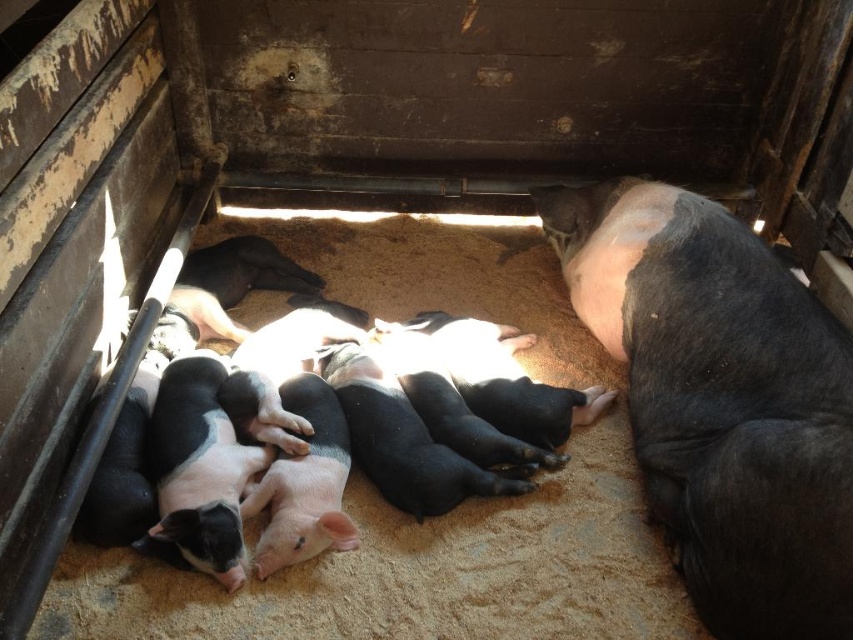
The width and height of the screenshot is (853, 640). Identify the location of black matte pig at right. (721, 401).

Locate an element on the screen. Image resolution: width=853 pixels, height=640 pixels. black matte pig at right is located at coordinates (721, 401).